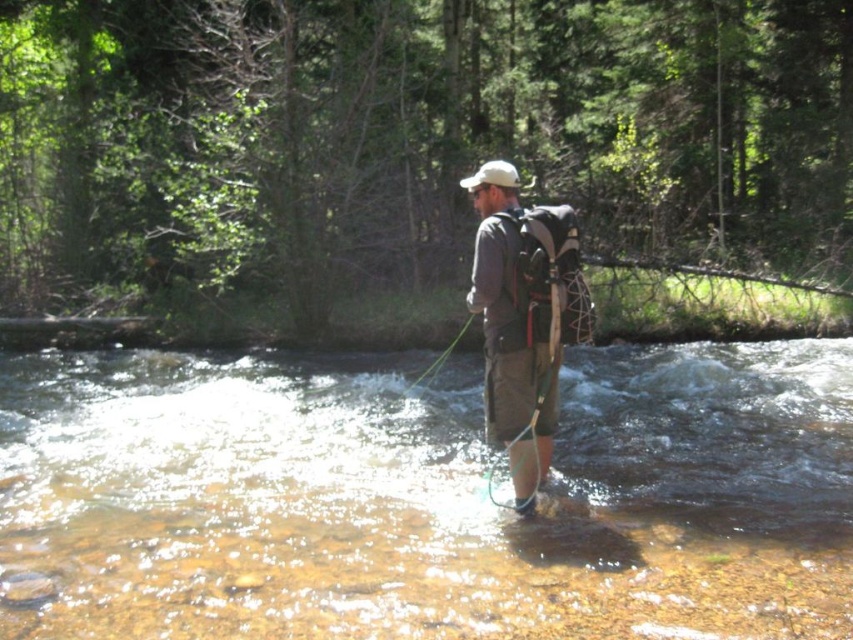
Does point (635, 461) come in front of point (482, 241)?

That is False.

Is clear water at center in front of gray fabric backpack at center?

Yes, clear water at center is in front of gray fabric backpack at center.

Locate an element on the screen. clear water at center is located at coordinates (424, 499).

The height and width of the screenshot is (640, 853). Identify the location of clear water at center. (424, 499).